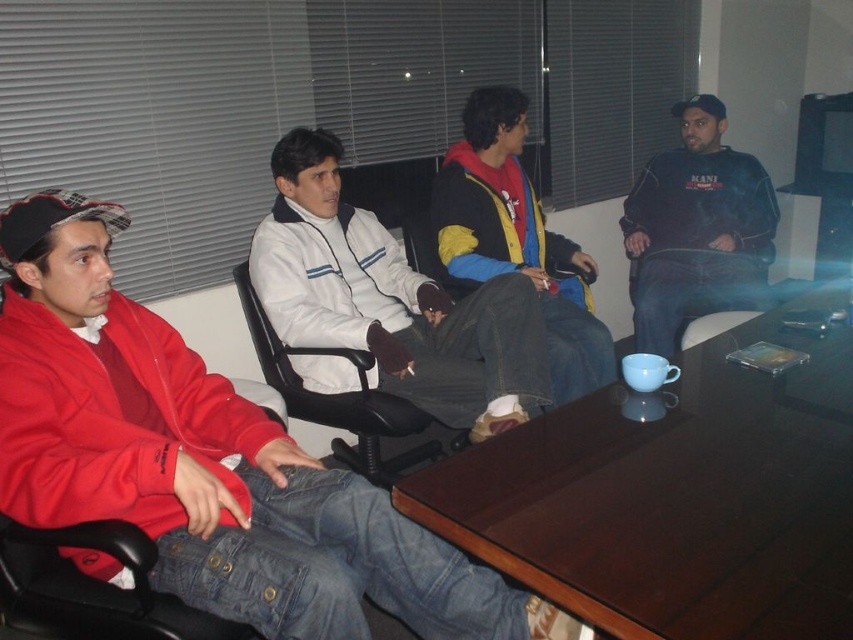
Question: Among these points, which one is farthest from the camera?

Choices:
 (A) (663, 326)
 (B) (659, 545)

Answer: (A)

Question: Can you confirm if brown wooden table at center is wider than black leather swivel chair at center?

Choices:
 (A) no
 (B) yes

Answer: (B)

Question: Does matte red jacket at left have a lesser width compared to dark blue fleece at right?

Choices:
 (A) no
 (B) yes

Answer: (A)

Question: In this image, where is brown wooden table at center located relative to dark blue fleece at right?

Choices:
 (A) left
 (B) right

Answer: (A)

Question: Which object appears farthest from the camera in this image?

Choices:
 (A) brown wooden table at center
 (B) dark blue fleece at right
 (C) multicolored fleece jacket at center
 (D) matte red jacket at left

Answer: (B)

Question: Which point is closer to the camera?

Choices:
 (A) (322, 424)
 (B) (672, 301)

Answer: (A)